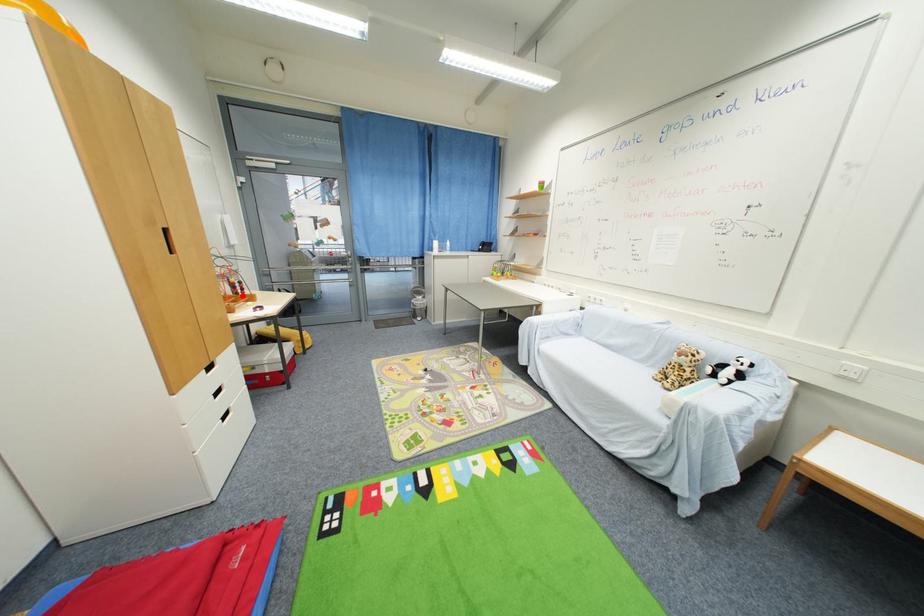
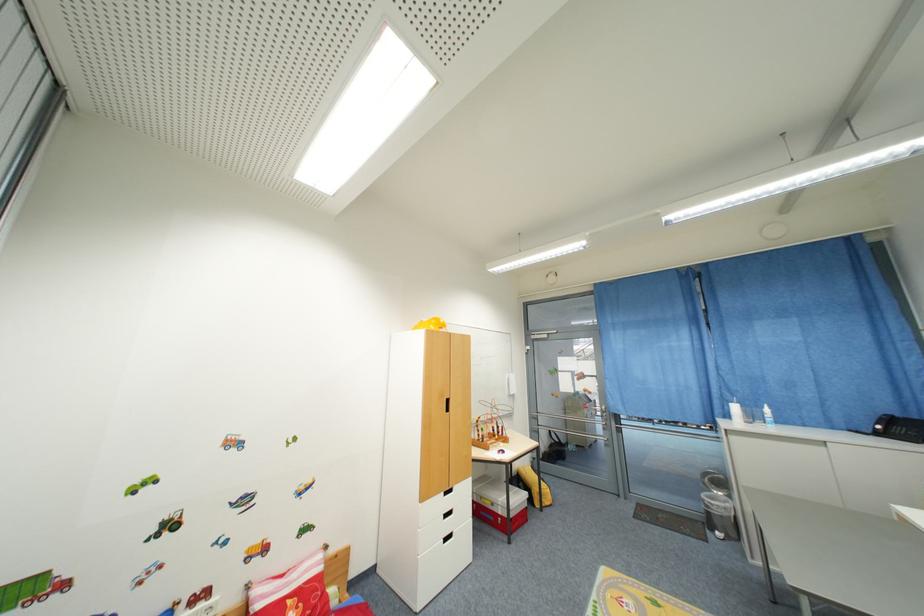
Question: I am providing you with two images of the same scene from different viewpoints. A red point is marked on the first image. At the location where the point appears in image 1, is it still visible in image 2?

Choices:
 (A) Yes
 (B) No

Answer: (A)